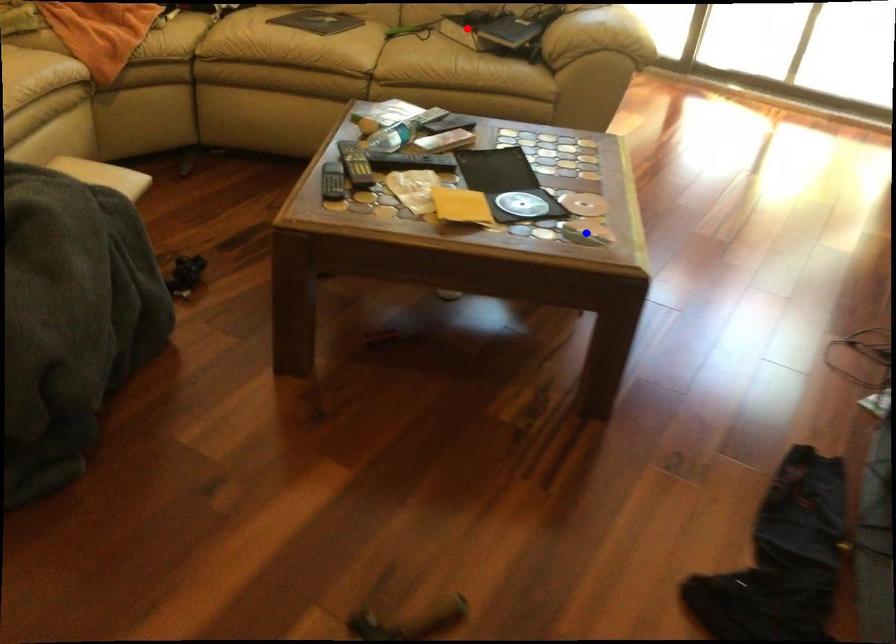
Question: In the image, two points are highlighted. Which point is nearer to the camera? Reply with the corresponding letter.

Choices:
 (A) blue point
 (B) red point

Answer: (A)